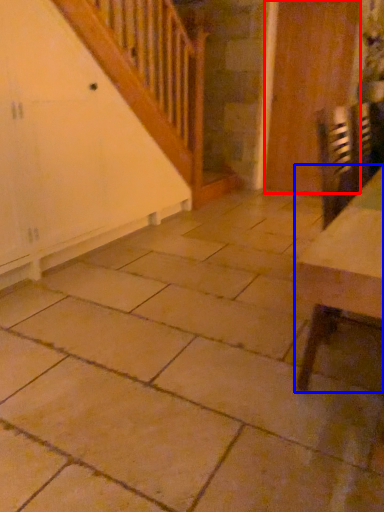
Question: Among these objects, which one is nearest to the camera, door (highlighted by a red box) or table (highlighted by a blue box)?

Choices:
 (A) door
 (B) table

Answer: (B)